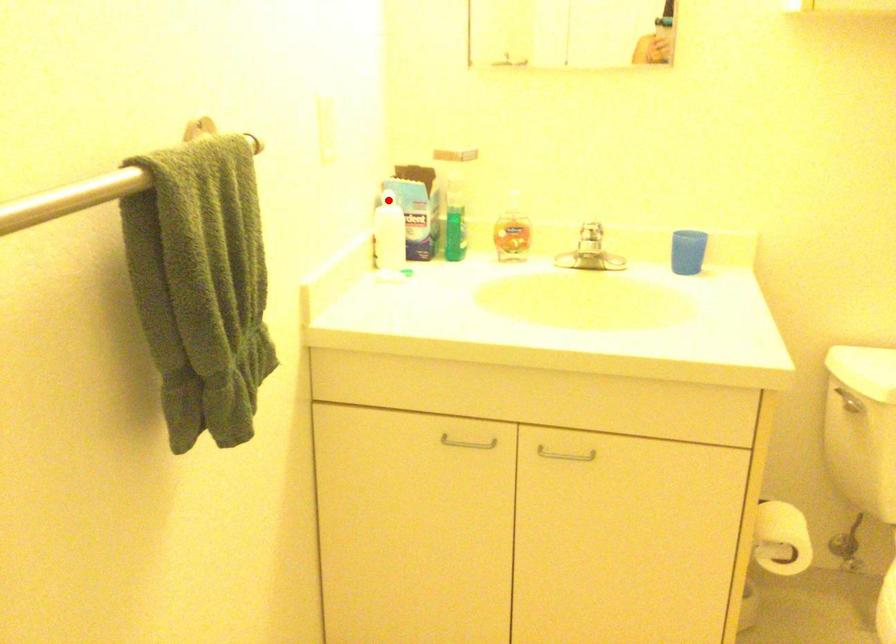
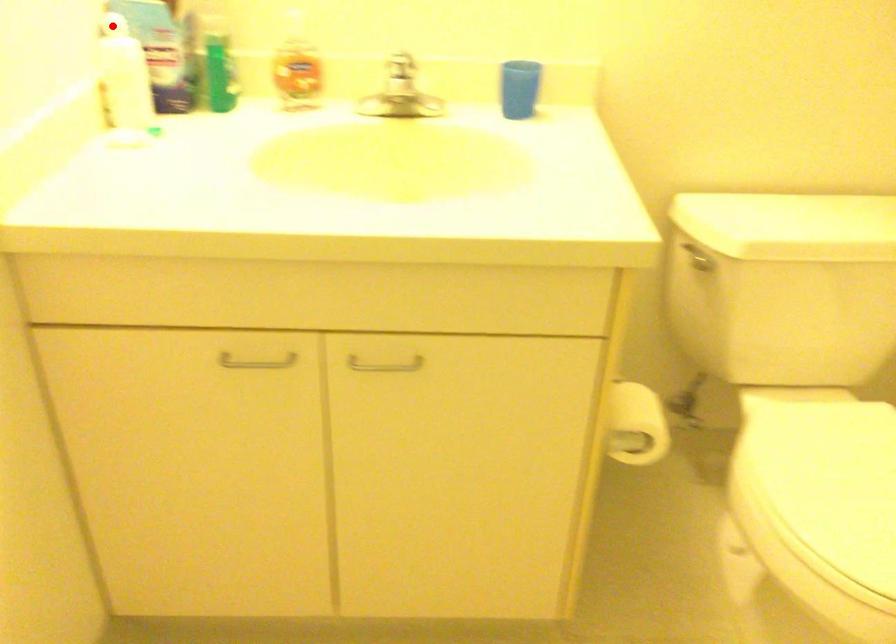
Consider the image. I am providing you with two images of the same scene from different viewpoints. A red point is marked on the first image and another point is marked on the second image. Are the points marked in image1 and image2 representing the same 3D position?

Yes